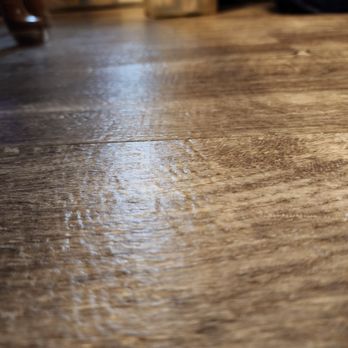
I want to click on possible door, so click(176, 10).